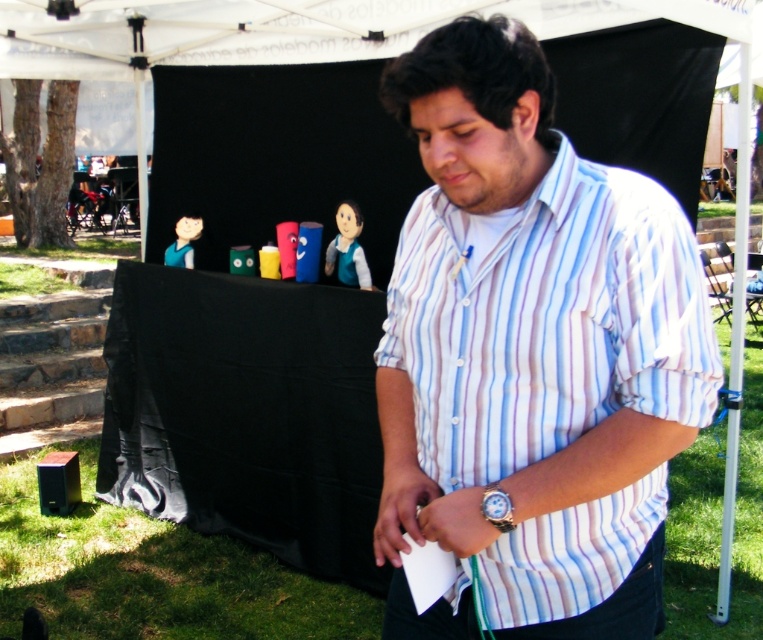
You are standing in front of the stage and want to pick up an item. The first item is at point (x=243, y=49) and the second item is at point (x=483, y=488). Which point is closer to you?

Point (x=243, y=49) is closer to you because it is further to the camera than point (x=483, y=488).

What are the coordinates of the white striped shirt at center?

The white striped shirt at center is located at coordinates point (530, 353).

You are a photographer at the event and want to capture the man in the white striped shirt at center and the white fabric canopy at upper center in a single frame. Which object should be placed closer to the camera to ensure both are in focus?

The white striped shirt at center should be placed closer to the camera because it is taller than the white fabric canopy at upper center, ensuring both are in focus.